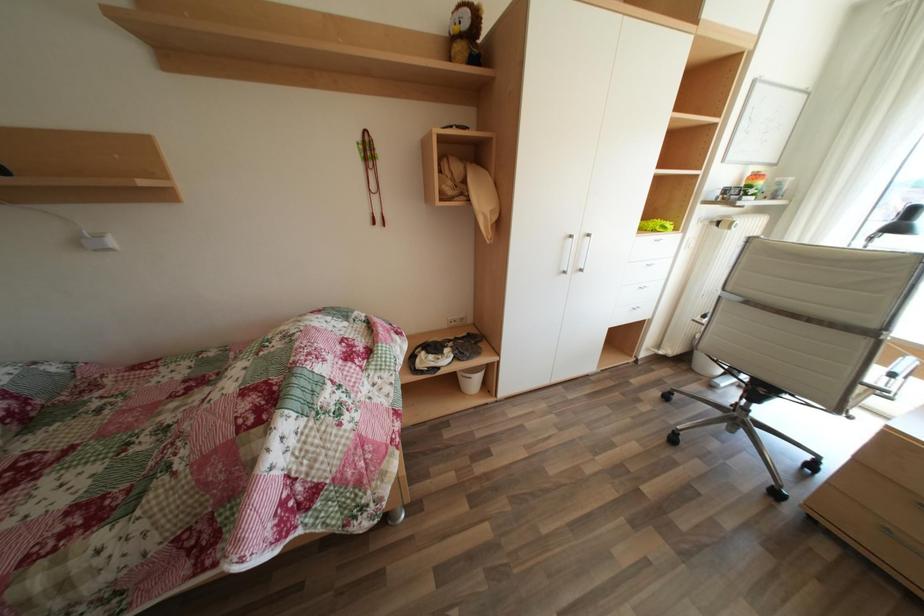
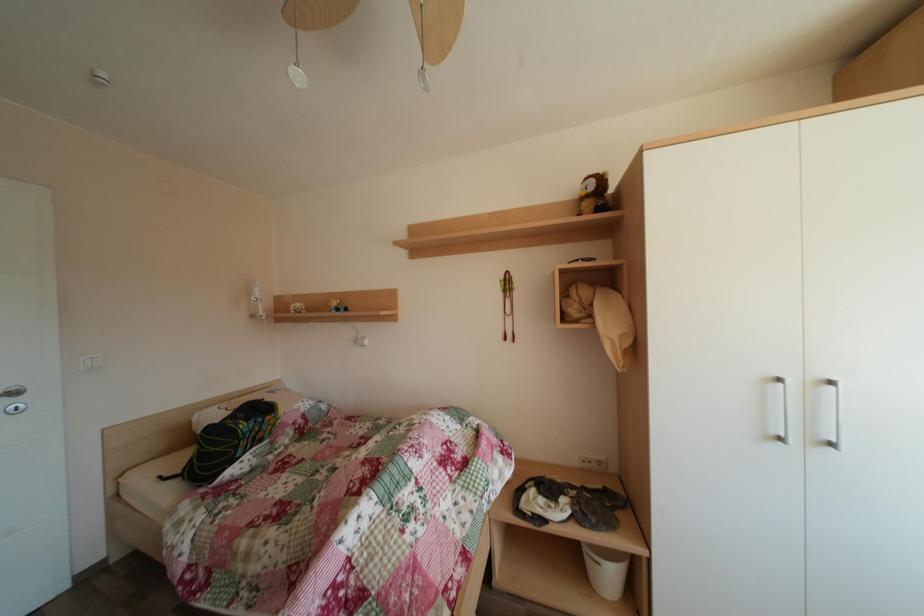
The first image is from the beginning of the video and the second image is from the end. How did the camera likely rotate when shooting the video?

The rotation direction of the camera is left-up.